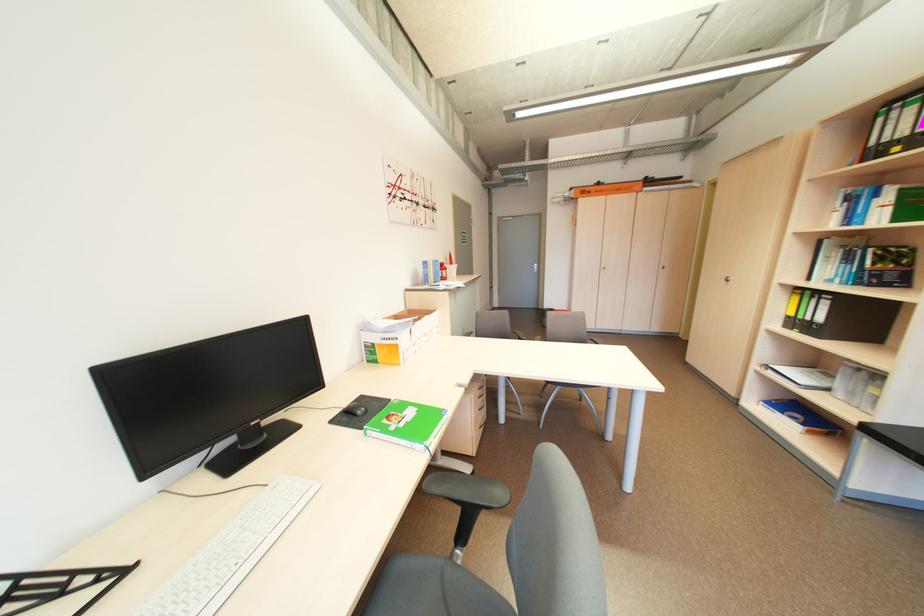
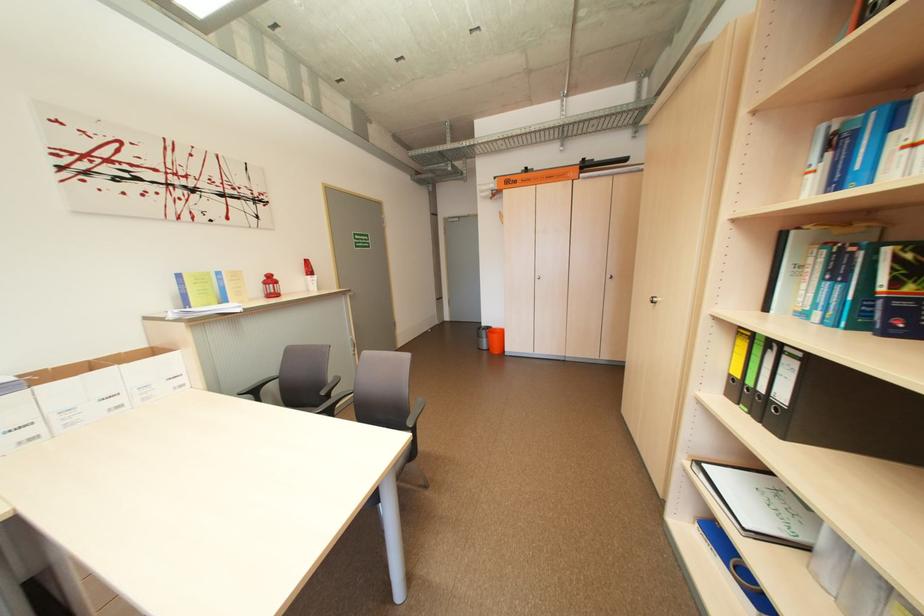
Find the pixel in the second image that matches pixel 805 325 in the first image.

(754, 394)